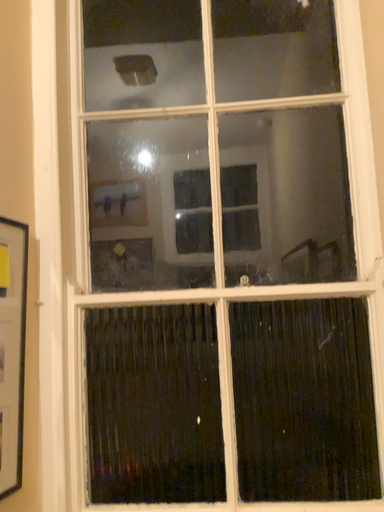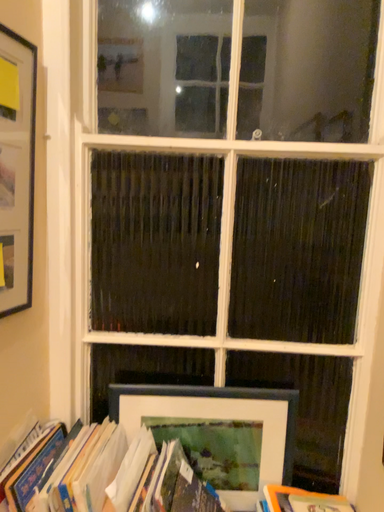
Question: Which way did the camera rotate in the video?

Choices:
 (A) rotated upward
 (B) rotated downward

Answer: (B)